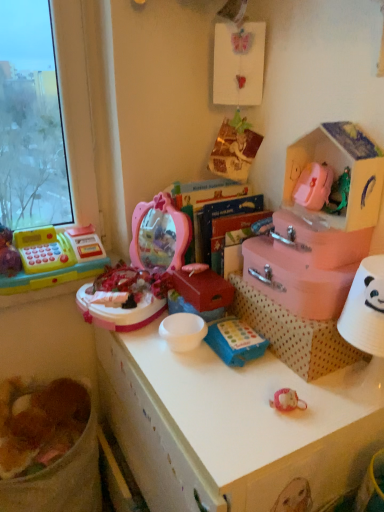
Find the location of a particular element. The height and width of the screenshot is (512, 384). free space in front of polka dot cardboard box at center is located at coordinates (273, 408).